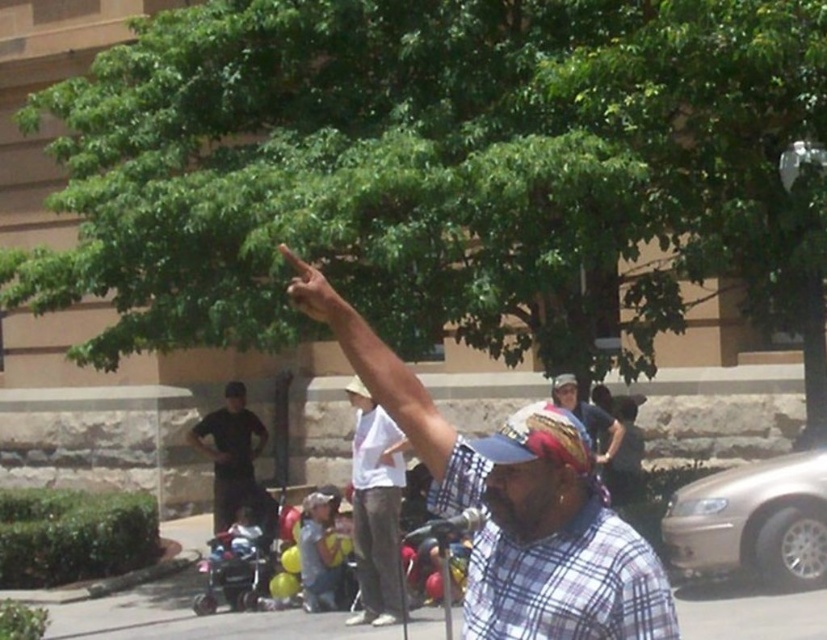
You are standing at the position of the man speaking into the microphone. You want to walk to the point labeled point (x=524, y=474) and then to point (x=237, y=417). Which direction should you turn after reaching the first point to face the second point?

After reaching point (x=524, y=474), you should turn to your right to face point (x=237, y=417) because point (x=237, y=417) is located to the right of point (x=524, y=474).

You are a photographer trying to capture a clear shot of the plaid shirt at upper center and the plaid fabric at center. Since both have similar patterns, you want to ensure you focus on the correct subject. Based on their positions, which one is closer to the camera?

The plaid shirt at upper center is closer to the camera than the plaid fabric at center, as the plaid fabric at center is positioned behind the plaid shirt at upper center.